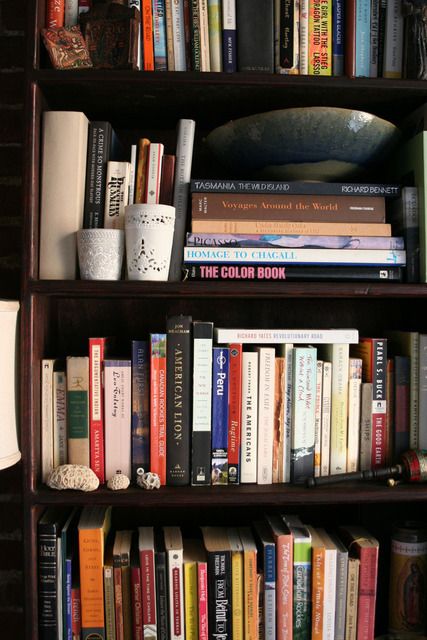
You are a GUI agent. You are given a task and a screenshot of the screen. Output one action in this format:
    pyautogui.click(x=<x>, y=<y>)
    Task: Click on the shelving
    
    Given the screenshot: What is the action you would take?
    pyautogui.click(x=130, y=285), pyautogui.click(x=152, y=490), pyautogui.click(x=165, y=77), pyautogui.click(x=32, y=460)